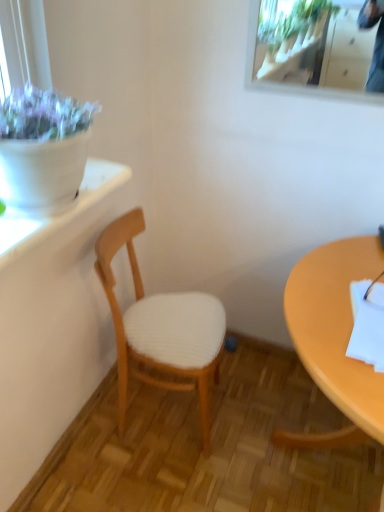
I want to click on vacant area that lies between wooden chair at center and matte yellow desk at right, so click(217, 435).